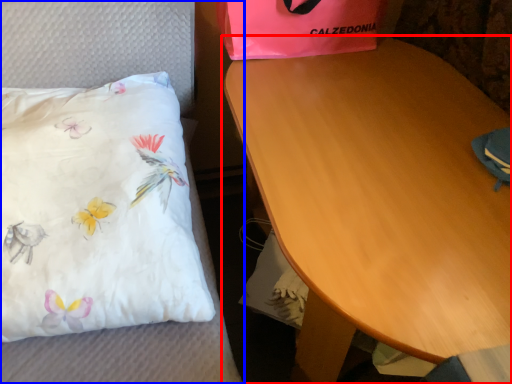
Question: Which object appears closest to the camera in this image, table (highlighted by a red box) or furniture (highlighted by a blue box)?

Choices:
 (A) table
 (B) furniture

Answer: (A)